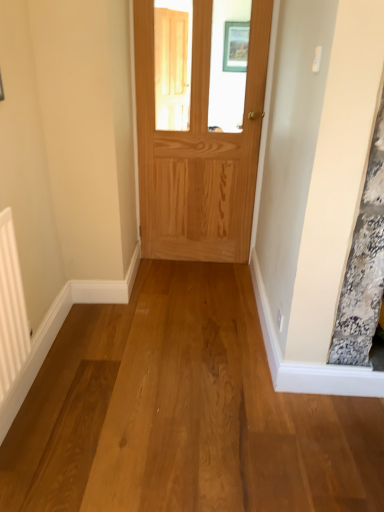
Question: From a real-world perspective, is natural wood door at center positioned over white textured radiator at left based on gravity?

Choices:
 (A) yes
 (B) no

Answer: (A)

Question: Does natural wood door at center have a greater width compared to white textured radiator at left?

Choices:
 (A) no
 (B) yes

Answer: (B)

Question: Considering the relative sizes of natural wood door at center and white textured radiator at left in the image provided, is natural wood door at center thinner than white textured radiator at left?

Choices:
 (A) yes
 (B) no

Answer: (B)

Question: Is natural wood door at center further to the viewer compared to white textured radiator at left?

Choices:
 (A) no
 (B) yes

Answer: (B)

Question: Is natural wood door at center turned away from white textured radiator at left?

Choices:
 (A) no
 (B) yes

Answer: (A)

Question: Does natural wood door at center touch white textured radiator at left?

Choices:
 (A) no
 (B) yes

Answer: (A)

Question: Is the position of white textured radiator at left less distant than that of natural wood door at center?

Choices:
 (A) yes
 (B) no

Answer: (A)

Question: Is white textured radiator at left behind natural wood door at center?

Choices:
 (A) yes
 (B) no

Answer: (B)

Question: From the image's perspective, would you say white textured radiator at left is positioned over natural wood door at center?

Choices:
 (A) yes
 (B) no

Answer: (B)

Question: Can you confirm if white textured radiator at left is bigger than natural wood door at center?

Choices:
 (A) yes
 (B) no

Answer: (B)

Question: Is white textured radiator at left positioned beyond the bounds of natural wood door at center?

Choices:
 (A) yes
 (B) no

Answer: (A)

Question: Is white textured radiator at left next to natural wood door at center?

Choices:
 (A) yes
 (B) no

Answer: (B)

Question: Which is correct: white textured radiator at left is inside natural wood door at center, or outside of it?

Choices:
 (A) outside
 (B) inside

Answer: (A)